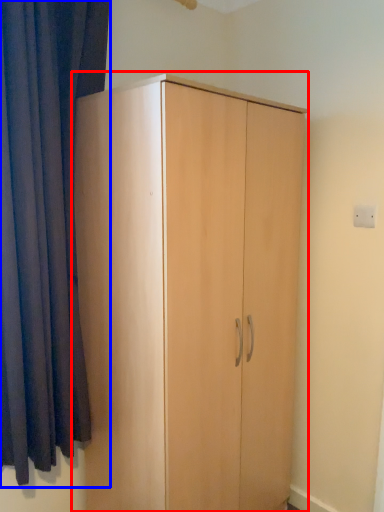
Question: Which object is closer to the camera taking this photo, cupboard (highlighted by a red box) or curtain (highlighted by a blue box)?

Choices:
 (A) cupboard
 (B) curtain

Answer: (B)